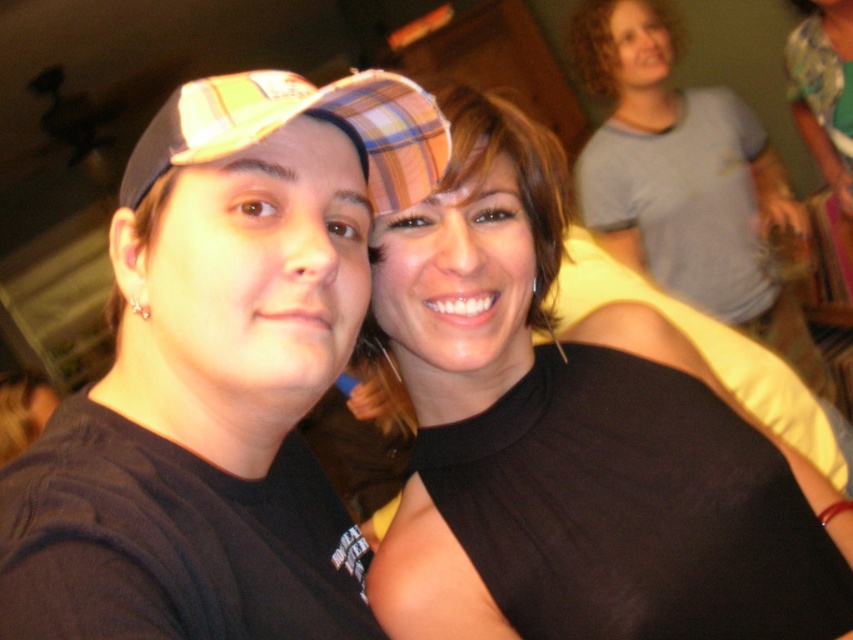
Is matte black cap at left shorter than plaid fabric baseball cap at left?

Incorrect, matte black cap at left's height does not fall short of plaid fabric baseball cap at left's.

What are the coordinates of `matte black cap at left` in the screenshot? It's located at (219, 372).

Find the location of a particular element. The width and height of the screenshot is (853, 640). matte black cap at left is located at coordinates (219, 372).

Which is more to the left, black matte tank top at upper right or plaid fabric baseball cap at left?

From the viewer's perspective, plaid fabric baseball cap at left appears more on the left side.

Is point (393, 582) closer to camera compared to point (242, 113)?

That is False.

This screenshot has height=640, width=853. Identify the location of black matte tank top at upper right. (573, 440).

Can you confirm if matte black cap at left is smaller than black matte tank top at upper right?

Yes.

Who is lower down, matte black cap at left or black matte tank top at upper right?

Positioned lower is black matte tank top at upper right.

Which is in front, point (125, 262) or point (665, 499)?

Positioned in front is point (125, 262).

I want to click on matte black cap at left, so click(x=219, y=372).